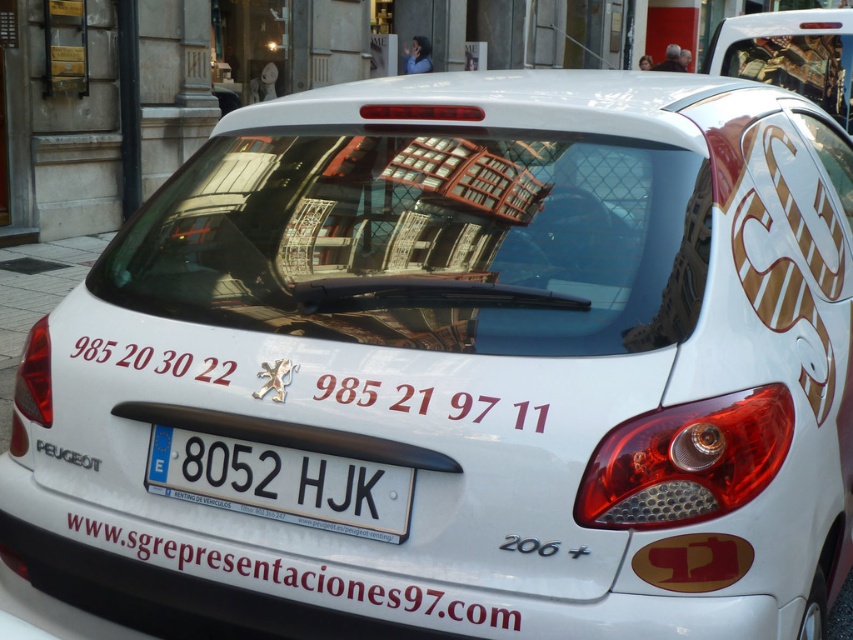
Question: Does white plastic license plate at center have a greater width compared to white matte text at center?

Choices:
 (A) no
 (B) yes

Answer: (A)

Question: Which point appears farthest from the camera in this image?

Choices:
 (A) (312, 484)
 (B) (426, 618)

Answer: (A)

Question: Can you confirm if white plastic license plate at center is positioned to the right of white matte text at center?

Choices:
 (A) no
 (B) yes

Answer: (B)

Question: Among these objects, which one is farthest from the camera?

Choices:
 (A) white matte text at center
 (B) white plastic license plate at center

Answer: (B)

Question: Is white plastic license plate at center positioned at the back of white matte text at center?

Choices:
 (A) yes
 (B) no

Answer: (A)

Question: Which point is closer to the camera?

Choices:
 (A) (341, 502)
 (B) (161, 566)

Answer: (A)